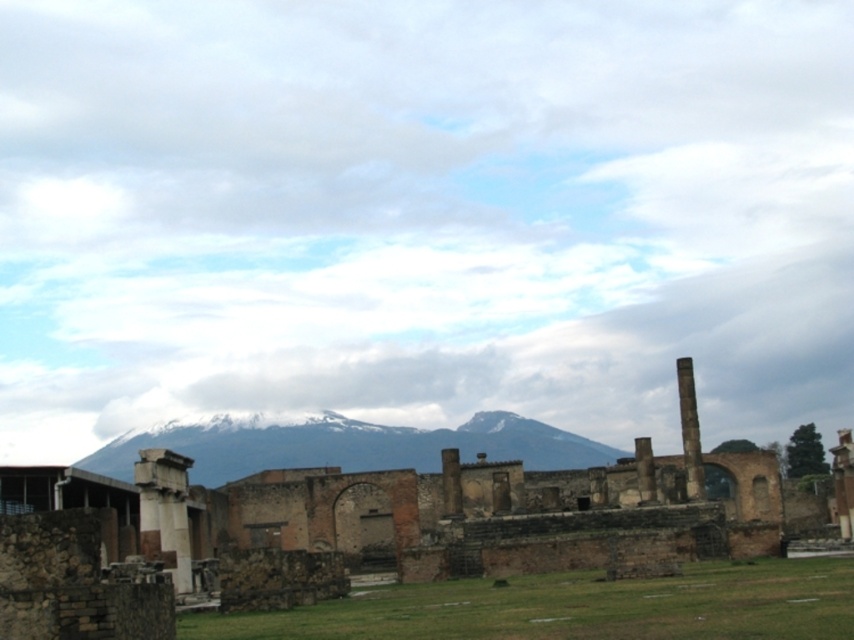
You are standing at the historical site and want to take a photo that includes both the ancient ruins and the mountain range in the background. Which point, point (217,520) or point (685,381), is closer to you and would allow you to frame the ruins and mountains effectively?

Point (217,520) is closer to you, so it would allow you to frame the ruins and mountains effectively by positioning yourself closer to the foreground ruins while still capturing the background mountains.

What are the coordinates of the snowy rock mountain at center in the image?

The coordinates of the snowy rock mountain at center are at point (349,445).